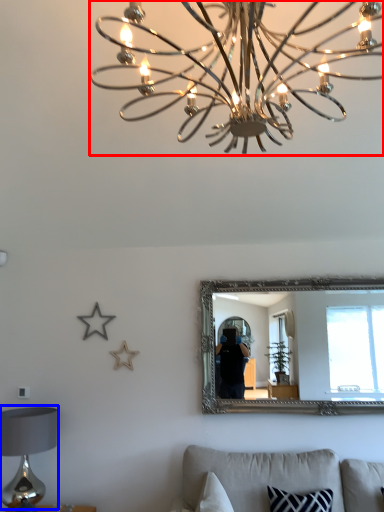
Question: Which object appears farthest to the camera in this image, lamp (highlighted by a red box) or table lamp (highlighted by a blue box)?

Choices:
 (A) lamp
 (B) table lamp

Answer: (B)